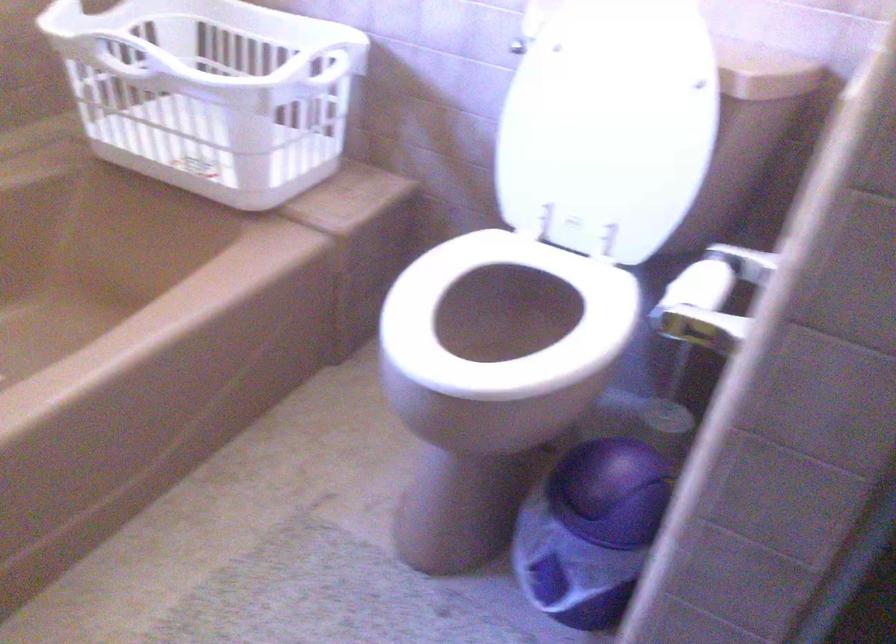
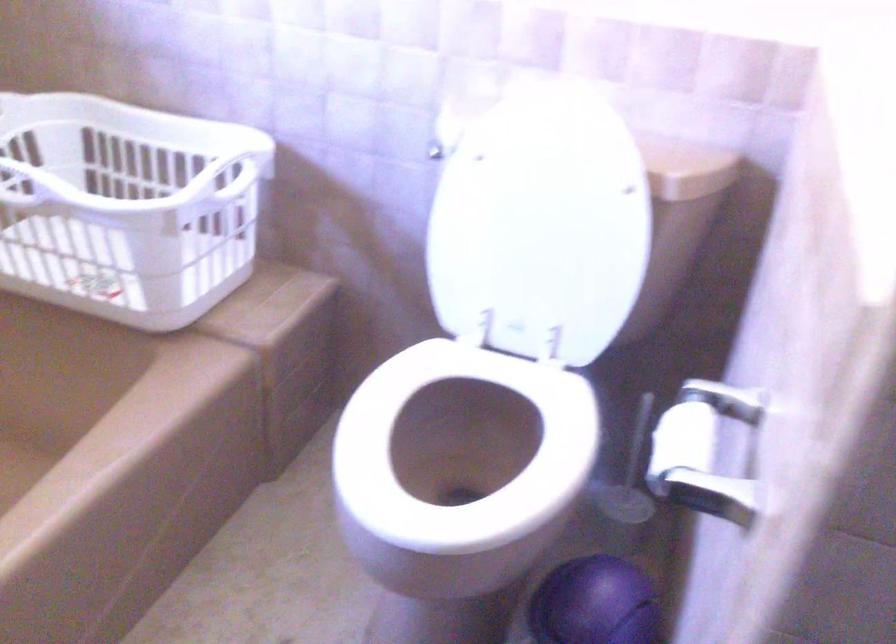
Find the pixel in the second image that matches point (707, 287) in the first image.

(698, 438)